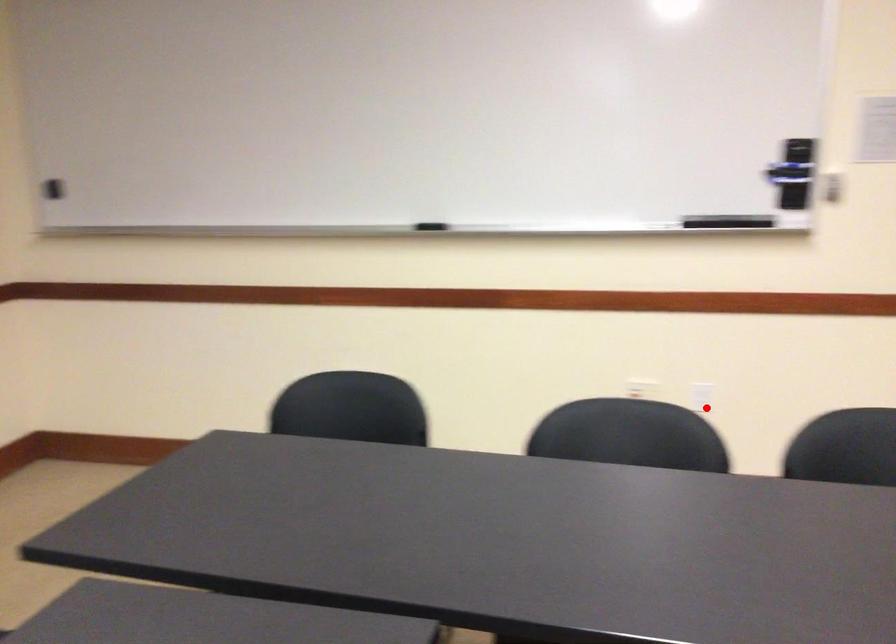
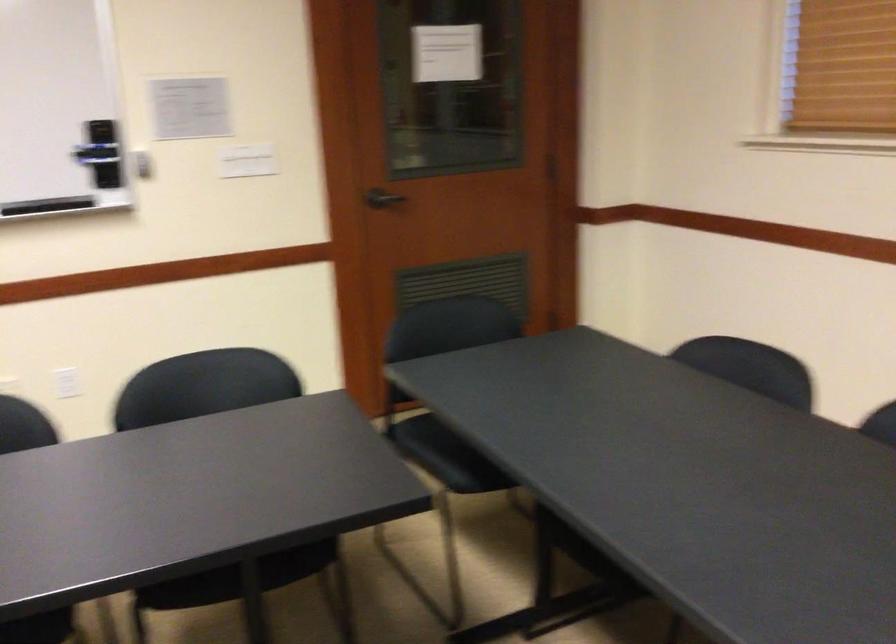
Question: I am providing you with two images of the same scene from different viewpoints. A red point is marked on the first image. Can you still see the location of the red point in image 2?

Choices:
 (A) Yes
 (B) No

Answer: (A)